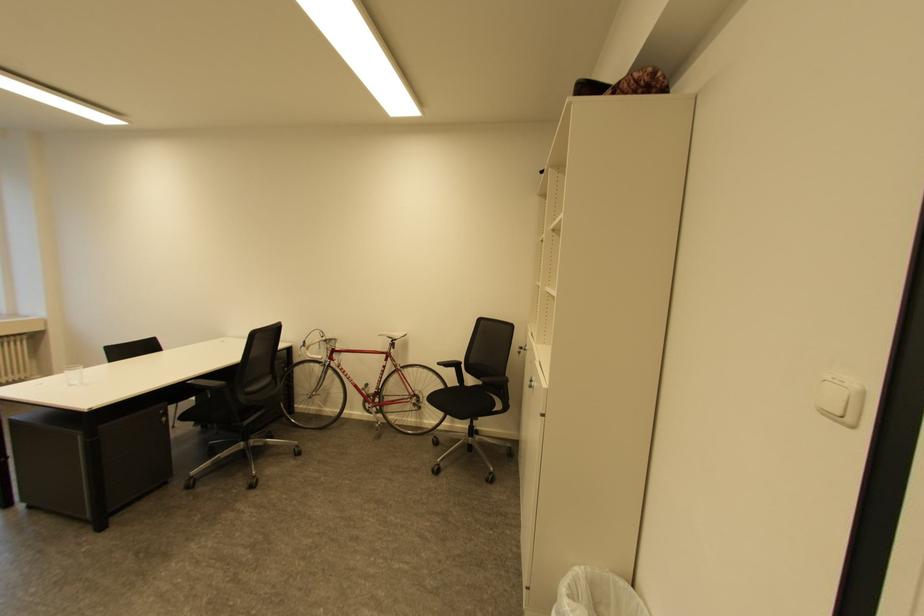
Describe the element at coordinates (319, 346) in the screenshot. This screenshot has width=924, height=616. I see `the bicycle handlebars` at that location.